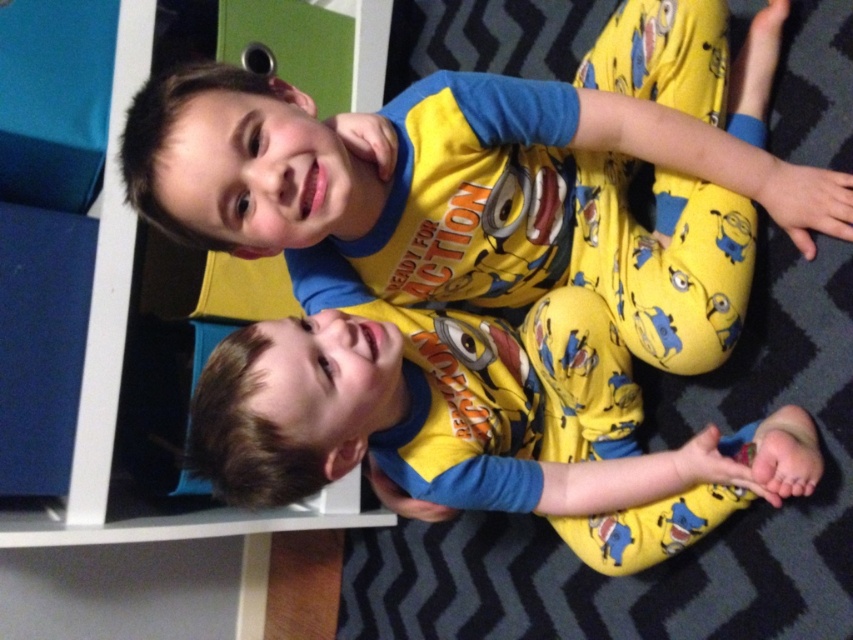
Question: Does matte plastic bookshelf at upper left have a larger size compared to yellow cotton pajamas at lower center?

Choices:
 (A) yes
 (B) no

Answer: (A)

Question: Which point is closer to the camera?

Choices:
 (A) yellow cotton pajamas at lower center
 (B) matte plastic bookshelf at upper left

Answer: (A)

Question: Can you confirm if matte plastic bookshelf at upper left is positioned to the left of yellow cotton pajamas at lower center?

Choices:
 (A) no
 (B) yes

Answer: (B)

Question: Can you confirm if matte plastic bookshelf at upper left is wider than yellow cotton pajamas at lower center?

Choices:
 (A) yes
 (B) no

Answer: (A)